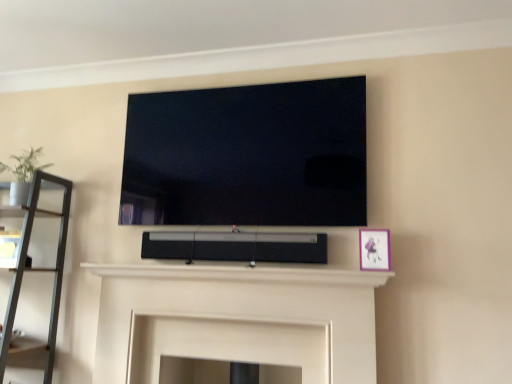
Question: Would you say flat screen tv at upper center is outside white matte fireplace at center?

Choices:
 (A) no
 (B) yes

Answer: (B)

Question: From the image's perspective, is flat screen tv at upper center under white matte fireplace at center?

Choices:
 (A) yes
 (B) no

Answer: (B)

Question: From a real-world perspective, is flat screen tv at upper center beneath white matte fireplace at center?

Choices:
 (A) no
 (B) yes

Answer: (A)

Question: Can you confirm if flat screen tv at upper center is thinner than white matte fireplace at center?

Choices:
 (A) yes
 (B) no

Answer: (B)

Question: Is flat screen tv at upper center far away from white matte fireplace at center?

Choices:
 (A) no
 (B) yes

Answer: (A)

Question: Can you confirm if flat screen tv at upper center is wider than white matte fireplace at center?

Choices:
 (A) yes
 (B) no

Answer: (A)

Question: Would you consider black matte speaker at center to be distant from white matte fireplace at center?

Choices:
 (A) no
 (B) yes

Answer: (A)

Question: Can you confirm if black matte speaker at center is bigger than white matte fireplace at center?

Choices:
 (A) yes
 (B) no

Answer: (B)

Question: Is black matte speaker at center with white matte fireplace at center?

Choices:
 (A) no
 (B) yes

Answer: (A)

Question: Is black matte speaker at center further to camera compared to white matte fireplace at center?

Choices:
 (A) yes
 (B) no

Answer: (A)

Question: Can we say black matte speaker at center lies outside white matte fireplace at center?

Choices:
 (A) yes
 (B) no

Answer: (A)

Question: From the image's perspective, does black matte speaker at center appear higher than white matte fireplace at center?

Choices:
 (A) no
 (B) yes

Answer: (B)

Question: Is matte pink picture frame at right taller than flat screen tv at upper center?

Choices:
 (A) no
 (B) yes

Answer: (A)